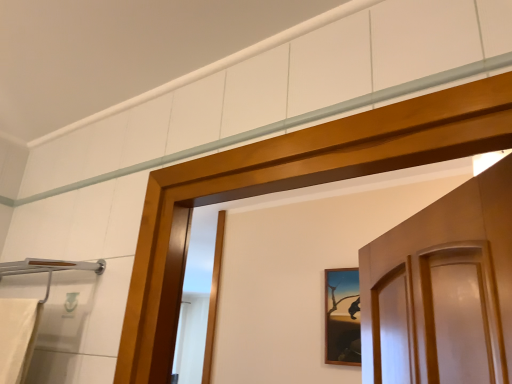
What do you see at coordinates (48, 268) in the screenshot? I see `silver metallic towel bar at left` at bounding box center [48, 268].

Identify the location of silver metallic towel bar at left. This screenshot has width=512, height=384. (48, 268).

The width and height of the screenshot is (512, 384). In order to click on silver metallic towel bar at left in this screenshot , I will do `click(48, 268)`.